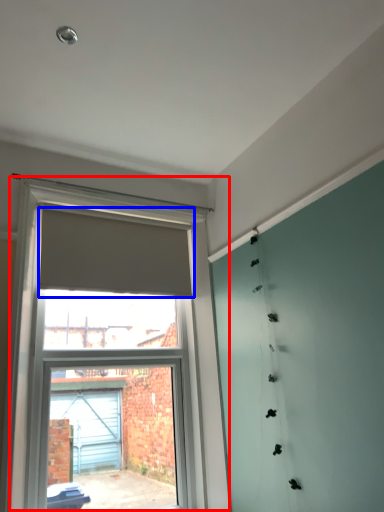
Question: Which point is further to the camera, window (highlighted by a red box) or curtain (highlighted by a blue box)?

Choices:
 (A) window
 (B) curtain

Answer: (B)